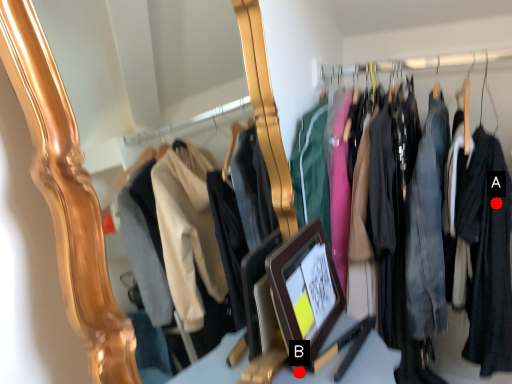
Question: Two points are circled on the image, labeled by A and B beside each circle. Which point is closer to the camera taking this photo?

Choices:
 (A) A is closer
 (B) B is closer

Answer: (B)